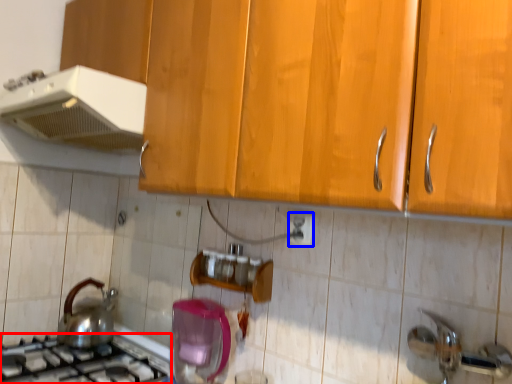
Question: Among these objects, which one is farthest to the camera, gas stove (highlighted by a red box) or electric outlet (highlighted by a blue box)?

Choices:
 (A) gas stove
 (B) electric outlet

Answer: (B)